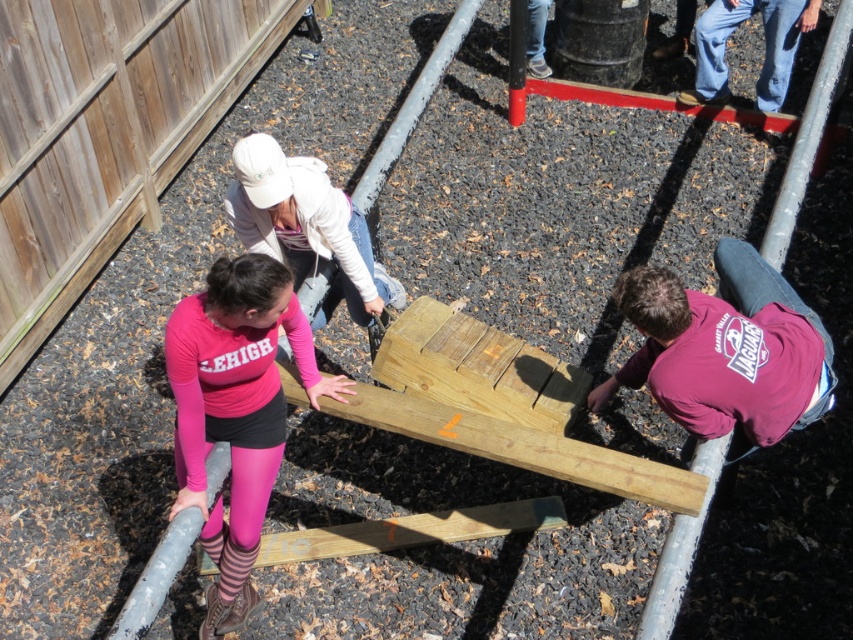
You are standing at the entrance of the playground and see the white matte jacket at upper center and the wooden plank at center. Which object is taller?

The white matte jacket at upper center is much taller than the wooden plank at center.

You are standing at the point labeled point [479,532] and want to walk to the wooden fence. Can you see the point labeled point [375,280] in your path towards the fence?

Since point [375,280] is behind point [479,532], you would not be able to see it while walking towards the wooden fence as it is located behind your current position.

You are an observer standing at the edge of the playground. You notice two items in the scene described in the scene. Which object is bigger in size between the pink matte leggings at lower left and the wooden plank at center?

The pink matte leggings at lower left is larger in size compared to the wooden plank at center according to the description.